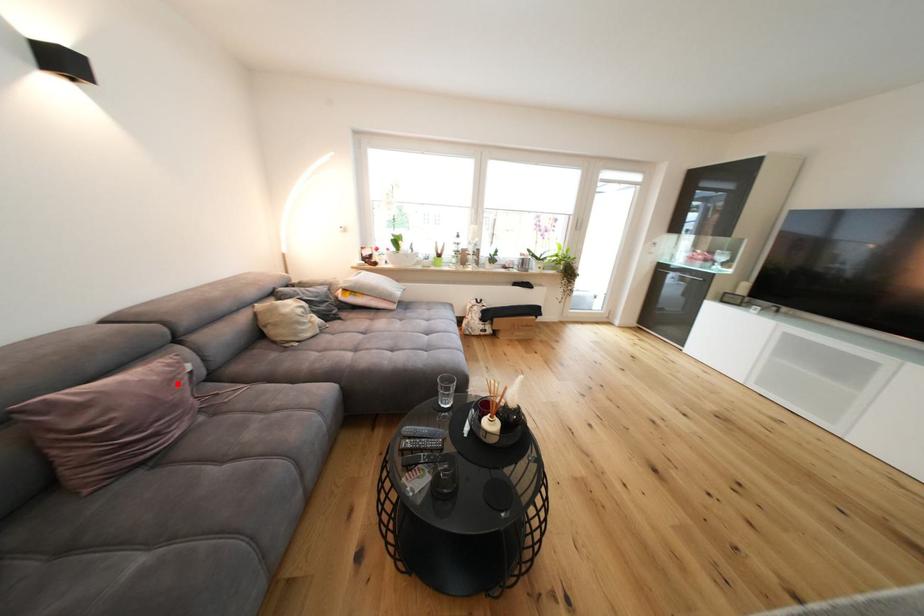
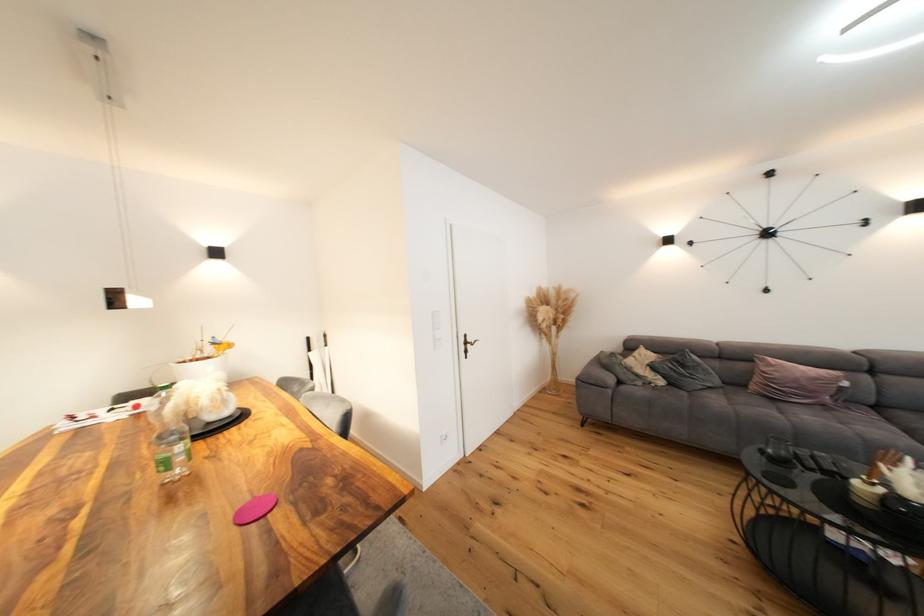
Question: A red point is marked in image1. In image2, is the corresponding 3D point closer to the camera or farther? Reply with the corresponding letter.

Choices:
 (A) The corresponding 3D point is closer.
 (B) The corresponding 3D point is farther.

Answer: (A)